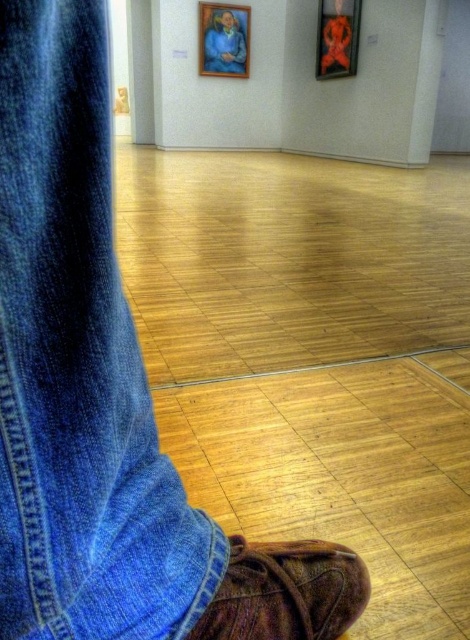
The image size is (470, 640). What do you see at coordinates (224, 38) in the screenshot?
I see `wooden frame at upper center` at bounding box center [224, 38].

In the scene shown: Which is more to the left, wooden frame at upper center or metallic gold picture frame at upper center?

Positioned to the left is wooden frame at upper center.

Does point (230, 70) lie in front of point (344, 60)?

No, it is behind (344, 60).

Locate an element on the screen. This screenshot has height=640, width=470. wooden frame at upper center is located at coordinates (224, 38).

Between denim at left and metallic gold picture frame at upper center, which one is positioned higher?

metallic gold picture frame at upper center

Locate an element on the screen. denim at left is located at coordinates (78, 365).

Is point (117, 560) less distant than point (336, 44)?

Yes, it is in front of point (336, 44).

Identify the location of denim at left. (78, 365).

Between brown suede shoe at lower right and metallic gold picture frame at upper center, which one has more height?

metallic gold picture frame at upper center

Who is positioned more to the right, brown suede shoe at lower right or metallic gold picture frame at upper center?

metallic gold picture frame at upper center is more to the right.

You are a GUI agent. You are given a task and a screenshot of the screen. Output one action in this format:
    pyautogui.click(x=<x>, y=<y>)
    Task: Click on the brown suede shoe at lower right
    
    Given the screenshot: What is the action you would take?
    pyautogui.click(x=286, y=592)